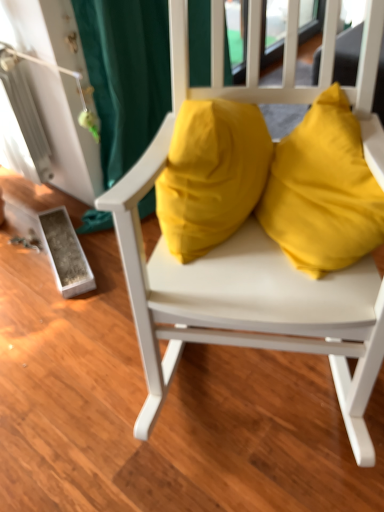
Question: Could you tell me if matte yellow cushions at center is facing yellow fabric pillow at center?

Choices:
 (A) no
 (B) yes

Answer: (B)

Question: Are matte yellow cushions at center and yellow fabric pillow at center located far from each other?

Choices:
 (A) yes
 (B) no

Answer: (B)

Question: From the image's perspective, is matte yellow cushions at center below yellow fabric pillow at center?

Choices:
 (A) no
 (B) yes

Answer: (B)

Question: Can you confirm if matte yellow cushions at center is shorter than yellow fabric pillow at center?

Choices:
 (A) yes
 (B) no

Answer: (B)

Question: Is matte yellow cushions at center wider than yellow fabric pillow at center?

Choices:
 (A) yes
 (B) no

Answer: (A)

Question: Is matte yellow cushions at center further to camera compared to yellow fabric pillow at center?

Choices:
 (A) yes
 (B) no

Answer: (B)

Question: Is matte yellow cushions at center a part of yellow fabric pillow at center?

Choices:
 (A) yes
 (B) no

Answer: (B)

Question: Is yellow fabric pillow at center to the left of matte yellow cushions at center from the viewer's perspective?

Choices:
 (A) no
 (B) yes

Answer: (B)

Question: From the image's perspective, is yellow fabric pillow at center beneath matte yellow cushions at center?

Choices:
 (A) no
 (B) yes

Answer: (A)

Question: Is yellow fabric pillow at center located outside matte yellow cushions at center?

Choices:
 (A) yes
 (B) no

Answer: (B)

Question: From a real-world perspective, is yellow fabric pillow at center positioned under matte yellow cushions at center based on gravity?

Choices:
 (A) yes
 (B) no

Answer: (B)

Question: Does yellow fabric pillow at center appear on the right side of matte yellow cushions at center?

Choices:
 (A) yes
 (B) no

Answer: (B)

Question: Relative to matte yellow cushions at center, is yellow fabric pillow at center in front or behind?

Choices:
 (A) front
 (B) behind

Answer: (B)